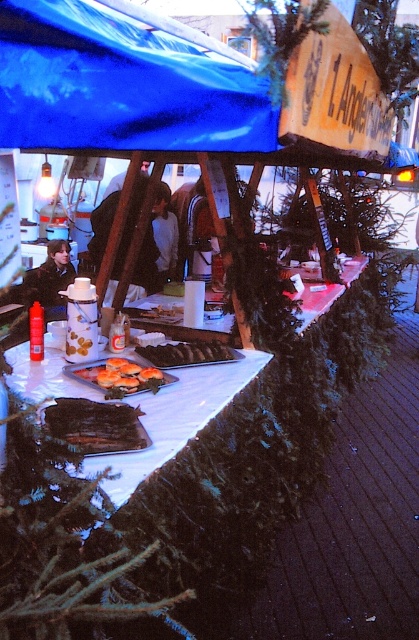
Question: Does golden brown pastry at center have a lesser width compared to brown wooden skewers at center?

Choices:
 (A) yes
 (B) no

Answer: (A)

Question: Which point is closer to the camera taking this photo?

Choices:
 (A) (162, 349)
 (B) (111, 360)

Answer: (B)

Question: Is golden brown pastry at center smaller than brown wooden skewers at center?

Choices:
 (A) yes
 (B) no

Answer: (A)

Question: Is golden brown pastry at center wider than brown wooden skewers at center?

Choices:
 (A) yes
 (B) no

Answer: (B)

Question: Which object appears farthest from the camera in this image?

Choices:
 (A) brown wooden skewers at center
 (B) golden brown pastry at center

Answer: (A)